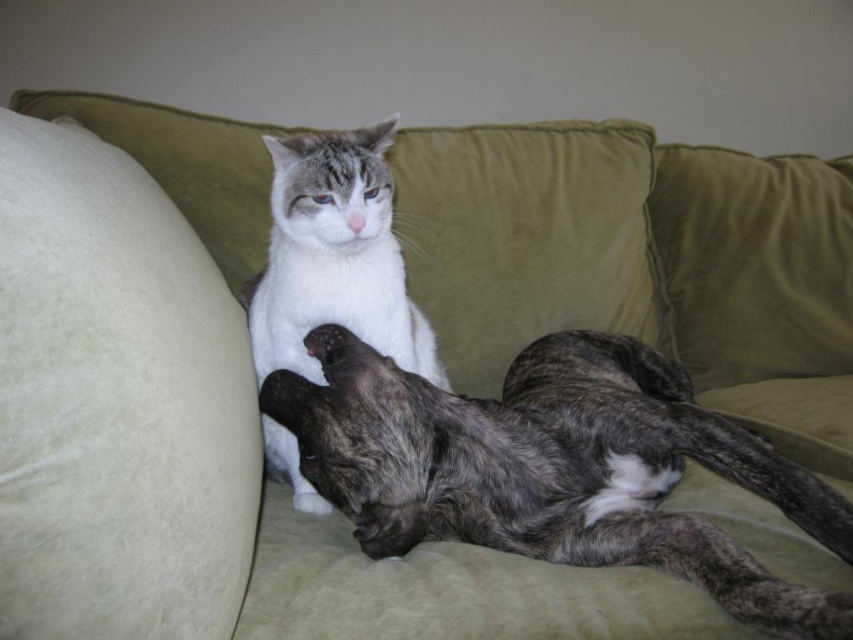
You are a cat owner who wants to place a new toy on the couch where the cats are resting. The toy is small and needs to be placed on the white soft cushion at left without disturbing the dark gray fur paw at center. Is this possible?

The white soft cushion at left is positioned over the dark gray fur paw at center, so placing the toy on the cushion would not disturb the paw since it is already under the cushion.

You are a photographer standing 30 inches away from a speckled fur dog at center. Can you take a clear photo of the dog without moving closer?

The speckled fur dog at center is 26.96 inches away from the viewer. Since you are standing 30 inches away, you are farther than the dog, so you can take a clear photo without moving closer.